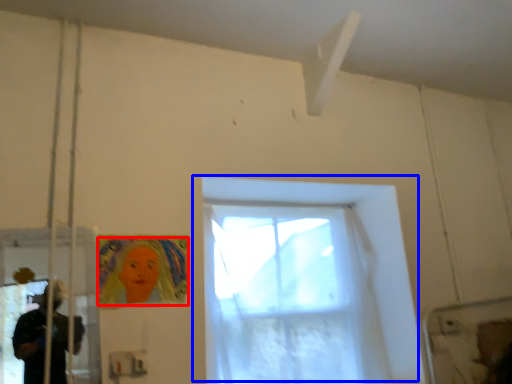
Question: Which of the following is the farthest to the observer, woman (highlighted by a red box) or window (highlighted by a blue box)?

Choices:
 (A) woman
 (B) window

Answer: (B)